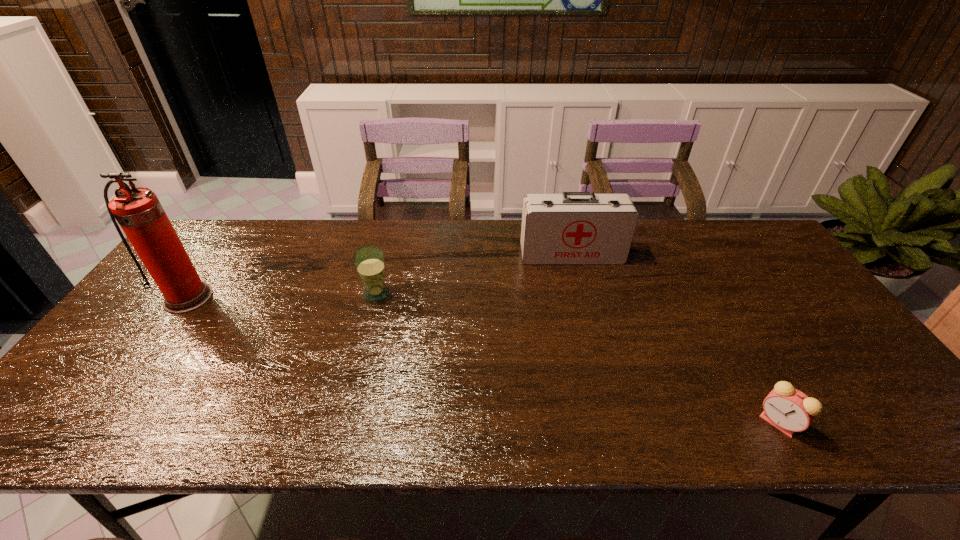
In the image, there is a desktop. Where is `vacant space at the far right corner`? The height and width of the screenshot is (540, 960). vacant space at the far right corner is located at coordinates click(x=747, y=234).

The image size is (960, 540). Identify the location of free point between the third shortest object and the second shortest object. (474, 274).

What are the coordinates of `vacant space that's between the second object from left to right and the rightmost object` in the screenshot? It's located at (577, 358).

This screenshot has height=540, width=960. I want to click on free area in between the glass and the tallest object, so click(282, 296).

Find the location of a particular element. This screenshot has height=540, width=960. vacant point located between the rightmost object and the glass is located at coordinates (577, 358).

Identify the location of empty location between the glass and the rightmost object. point(577,358).

Locate an element on the screen. The height and width of the screenshot is (540, 960). empty location between the farthest object and the rightmost object is located at coordinates coord(675,339).

Find the location of `free space between the tallest object and the second shortest object`. free space between the tallest object and the second shortest object is located at coordinates (282, 296).

Identify the location of vacant region between the leftmost object and the nearest object. (484, 360).

In order to click on vacant area that lies between the rightmost object and the glass in this screenshot , I will do `click(577, 358)`.